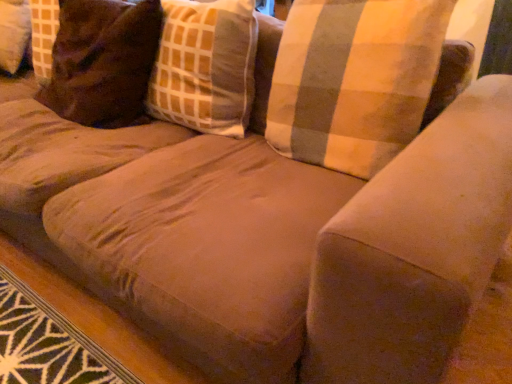
Question: Is plaid fabric pillow at upper right, the 1th pillow positioned from the right, positioned in front of brown suede pillow at upper left, which is the second pillow from right to left?

Choices:
 (A) no
 (B) yes

Answer: (B)

Question: Considering the relative sizes of plaid fabric pillow at upper right, the 1th pillow positioned from the right, and brown suede pillow at upper left, which is the second pillow from right to left, in the image provided, is plaid fabric pillow at upper right, the 1th pillow positioned from the right, shorter than brown suede pillow at upper left, which is the second pillow from right to left,?

Choices:
 (A) no
 (B) yes

Answer: (B)

Question: Does plaid fabric pillow at upper right, placed as the second pillow when sorted from left to right, have a larger size compared to brown suede pillow at upper left, which is the second pillow from right to left?

Choices:
 (A) yes
 (B) no

Answer: (B)

Question: Is plaid fabric pillow at upper right, the 1th pillow positioned from the right, completely or partially outside of brown suede pillow at upper left, which is the second pillow from right to left?

Choices:
 (A) yes
 (B) no

Answer: (A)

Question: From the image's perspective, relative to brown suede pillow at upper left, positioned as the first pillow in left-to-right order, is plaid fabric pillow at upper right, placed as the second pillow when sorted from left to right, above or below?

Choices:
 (A) above
 (B) below

Answer: (B)

Question: Is plaid fabric pillow at upper right, placed as the second pillow when sorted from left to right, in front of or behind brown suede pillow at upper left, positioned as the first pillow in left-to-right order, in the image?

Choices:
 (A) front
 (B) behind

Answer: (A)

Question: Looking at the image, does plaid fabric pillow at upper right, the 1th pillow positioned from the right, seem bigger or smaller compared to brown suede pillow at upper left, which is the second pillow from right to left?

Choices:
 (A) small
 (B) big

Answer: (A)

Question: Considering the positions of plaid fabric pillow at upper right, placed as the second pillow when sorted from left to right, and brown suede pillow at upper left, which is the second pillow from right to left, in the image, is plaid fabric pillow at upper right, placed as the second pillow when sorted from left to right, taller or shorter than brown suede pillow at upper left, which is the second pillow from right to left,?

Choices:
 (A) tall
 (B) short

Answer: (B)

Question: In the image, is plaid fabric pillow at upper right, placed as the second pillow when sorted from left to right, on the left side or the right side of plaid fabric pillow at center?

Choices:
 (A) right
 (B) left

Answer: (A)

Question: Does point (374, 91) appear closer or farther from the camera than point (182, 54)?

Choices:
 (A) closer
 (B) farther

Answer: (A)

Question: From their relative heights in the image, would you say plaid fabric pillow at upper right, placed as the second pillow when sorted from left to right, is taller or shorter than plaid fabric pillow at center?

Choices:
 (A) short
 (B) tall

Answer: (A)

Question: Considering the positions of plaid fabric pillow at upper right, placed as the second pillow when sorted from left to right, and plaid fabric pillow at center in the image, is plaid fabric pillow at upper right, placed as the second pillow when sorted from left to right, bigger or smaller than plaid fabric pillow at center?

Choices:
 (A) big
 (B) small

Answer: (A)

Question: Looking at their shapes, would you say brown suede pillow at upper left, which is the second pillow from right to left, is wider or thinner than plaid fabric pillow at upper right, the 1th pillow positioned from the right?

Choices:
 (A) thin
 (B) wide

Answer: (B)

Question: Considering the positions of point (82, 87) and point (292, 87), is point (82, 87) closer or farther from the camera than point (292, 87)?

Choices:
 (A) farther
 (B) closer

Answer: (A)